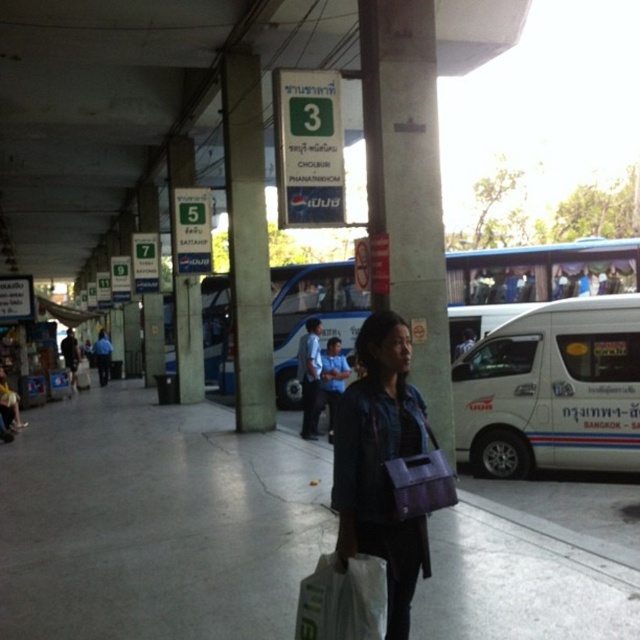
You are a delivery person who needs to park your 10 feet long white matte van at center near the concrete pillar at center. Can you park it there without overlapping the pillar?

The distance between the white matte van at center and concrete pillar at center is 9.77 feet. Since the van is 10 feet long, it would overlap the pillar by 0.23 feet if parked there.

You are a security guard at the bus station and need to ensure that the matte purple bag at center and the white matte shopping bag at lower center can fit into a storage locker. The locker has a maximum width requirement of 30 cm. Which bag is more likely to exceed the locker width limit?

The matte purple bag at center has a greater width than the white matte shopping bag at lower center, so it is more likely to exceed the locker width limit of 30 cm.